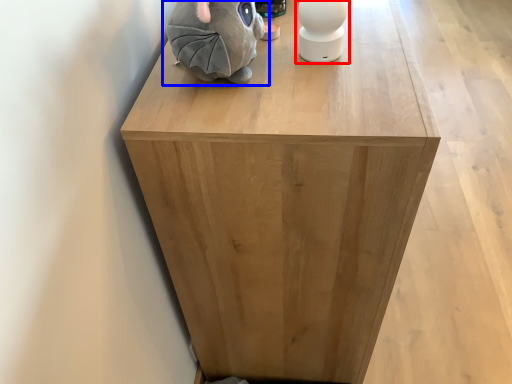
Question: Which point is closer to the camera, toy (highlighted by a red box) or toy (highlighted by a blue box)?

Choices:
 (A) toy
 (B) toy

Answer: (B)